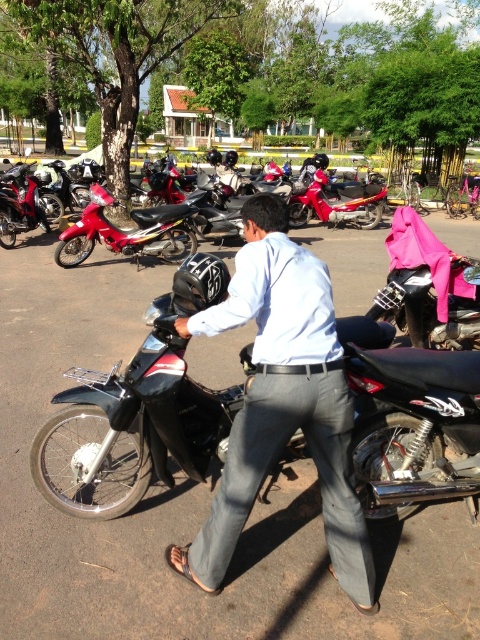
Question: Does shiny black motorcycle at center have a lesser width compared to metallic red motorcycle at center?

Choices:
 (A) no
 (B) yes

Answer: (B)

Question: Does shiny black motorcycle at center have a larger size compared to metallic red motorcycle at center?

Choices:
 (A) yes
 (B) no

Answer: (B)

Question: Estimate the real-world distances between objects in this image. Which object is closer to the matte red motorcycle at left?

Choices:
 (A) shiny red motorcycle at center
 (B) metallic red motorcycle at center

Answer: (A)

Question: Based on their relative distances, which object is farther from the shiny red motorcycle at center?

Choices:
 (A) metallic red motorcycle at center
 (B) shiny black motorcycle at center
 (C) light blue shirt at center
 (D) matte red motorcycle at left

Answer: (C)

Question: Which object appears closest to the camera in this image?

Choices:
 (A) metallic red motorcycle at center
 (B) shiny red motorcycle at center
 (C) light blue shirt at center

Answer: (C)

Question: Can you confirm if shiny black motorcycle at center is thinner than light blue shirt at center?

Choices:
 (A) no
 (B) yes

Answer: (A)